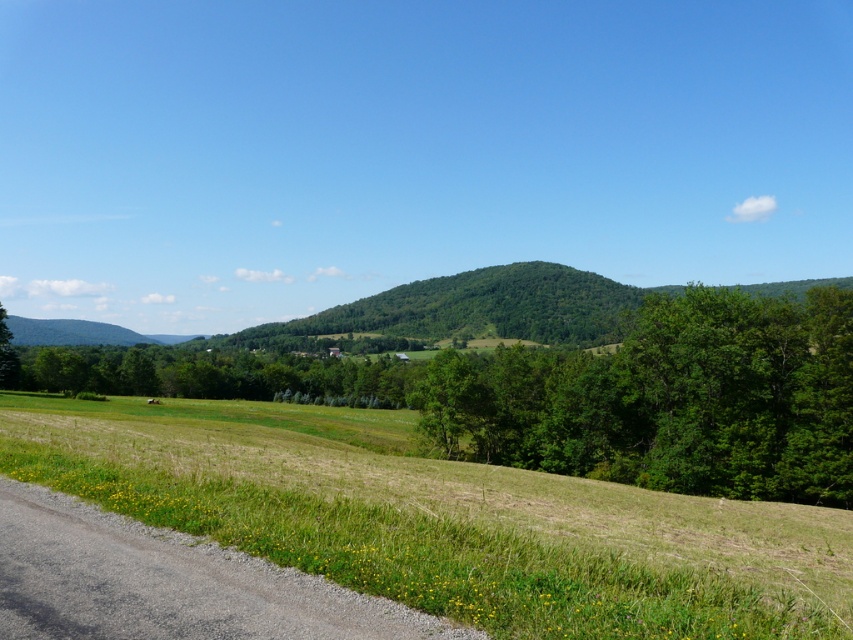
Describe the element at coordinates (668, 400) in the screenshot. The width and height of the screenshot is (853, 640). I see `green leafy tree at center` at that location.

Is green leafy tree at center wider than green leafy hill at center?

No, green leafy tree at center is not wider than green leafy hill at center.

Does point (523, 390) lie in front of point (525, 284)?

Yes, it is.

Locate an element on the screen. This screenshot has height=640, width=853. green leafy tree at center is located at coordinates (668, 400).